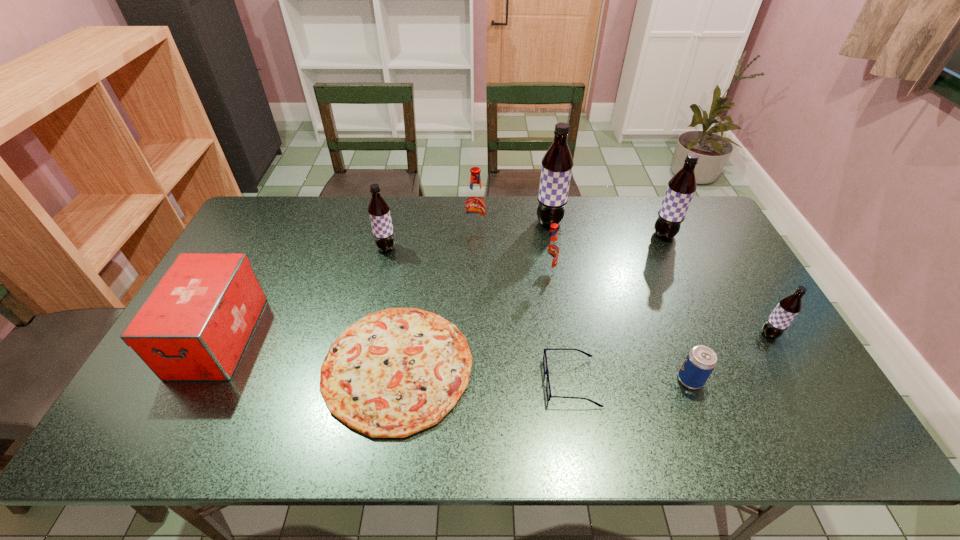
Locate an element on the screen. This screenshot has height=540, width=960. the tallest root beer is located at coordinates (557, 163).

I want to click on the third brown root beer from right to left, so click(557, 163).

Image resolution: width=960 pixels, height=540 pixels. I want to click on the third brown root beer from left to right, so click(x=681, y=187).

This screenshot has height=540, width=960. What are the coordinates of `the fifth root beer from left to right` in the screenshot? It's located at (681, 187).

At what (x,y) coordinates should I click in order to perform the action: click on the fifth root beer from right to left. Please return your answer as a coordinate pair (x, y). Looking at the image, I should click on (475, 201).

Find the location of a particular element. This screenshot has height=540, width=960. the left red root beer is located at coordinates (475, 201).

Where is `the leftmost root beer`? Image resolution: width=960 pixels, height=540 pixels. the leftmost root beer is located at coordinates (379, 211).

Find the location of a particular element. the leftmost brown root beer is located at coordinates (379, 211).

The image size is (960, 540). I want to click on the sixth nearest object, so click(x=550, y=252).

The width and height of the screenshot is (960, 540). Identify the location of the second nearest root beer. (550, 252).